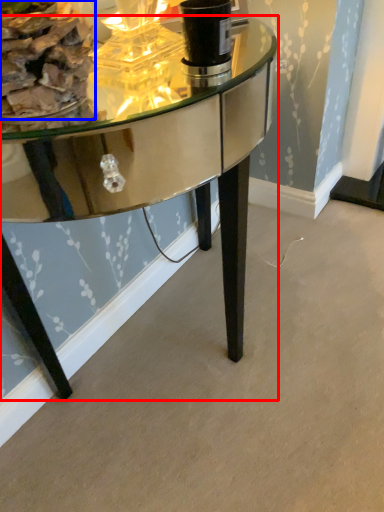
Question: Which point is closer to the camera, table (highlighted by a red box) or food (highlighted by a blue box)?

Choices:
 (A) table
 (B) food

Answer: (A)